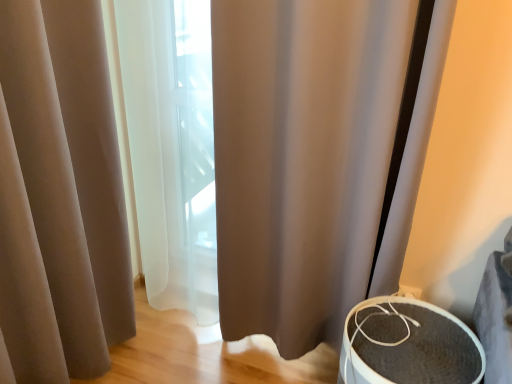
Question: Would you say matte beige curtain at left is to the left or to the right of textured gray speaker at lower right in the picture?

Choices:
 (A) left
 (B) right

Answer: (A)

Question: Is matte beige curtain at left wider or thinner than textured gray speaker at lower right?

Choices:
 (A) thin
 (B) wide

Answer: (A)

Question: Estimate the real-world distances between objects in this image. Which object is closer to the brown fabric shower curtain at center?

Choices:
 (A) textured gray speaker at lower right
 (B) matte beige curtain at left

Answer: (A)

Question: Which object is the farthest from the brown fabric shower curtain at center?

Choices:
 (A) matte beige curtain at left
 (B) textured gray speaker at lower right

Answer: (A)